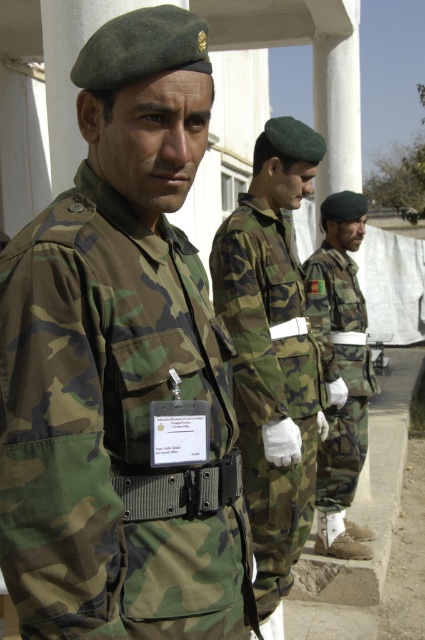
Does point (172, 620) lie in front of point (263, 451)?

Yes, it is in front of point (263, 451).

Between point (198, 340) and point (235, 330), which one is positioned in front?

Point (198, 340)

Locate an element on the screen. camo uniform at center is located at coordinates (121, 365).

Does camouflage fabric uniform at center appear under camo fabric uniform at center?

Indeed, camouflage fabric uniform at center is positioned under camo fabric uniform at center.

Between camouflage fabric uniform at center and camo fabric uniform at center, which one appears on the right side from the viewer's perspective?

camo fabric uniform at center

This screenshot has height=640, width=425. I want to click on camouflage fabric uniform at center, so click(x=269, y=384).

Between camo uniform at center and camo fabric uniform at center, which one appears on the right side from the viewer's perspective?

Positioned to the right is camo fabric uniform at center.

Can you confirm if camo uniform at center is shorter than camo fabric uniform at center?

Correct, camo uniform at center is not as tall as camo fabric uniform at center.

Where is `camo uniform at center`? camo uniform at center is located at coordinates (121, 365).